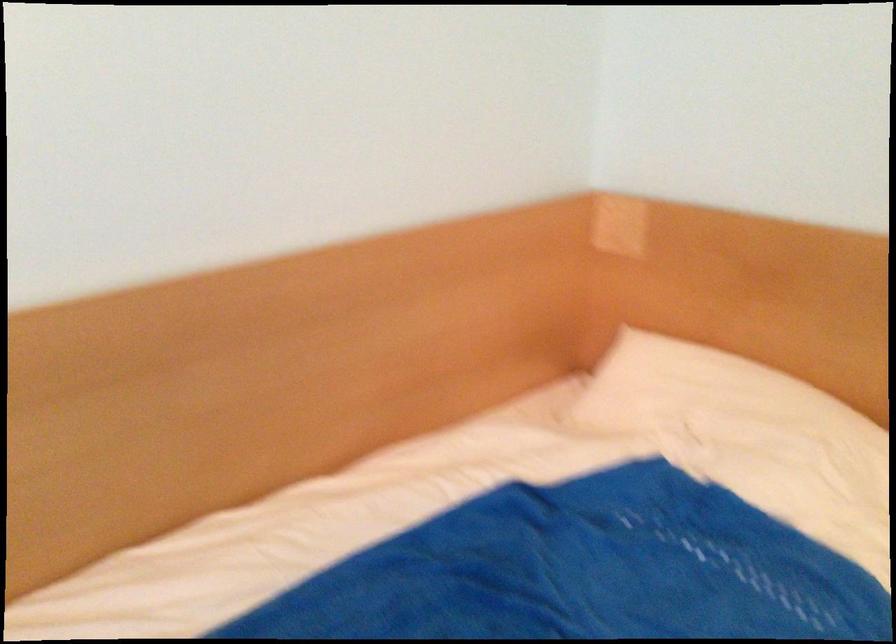
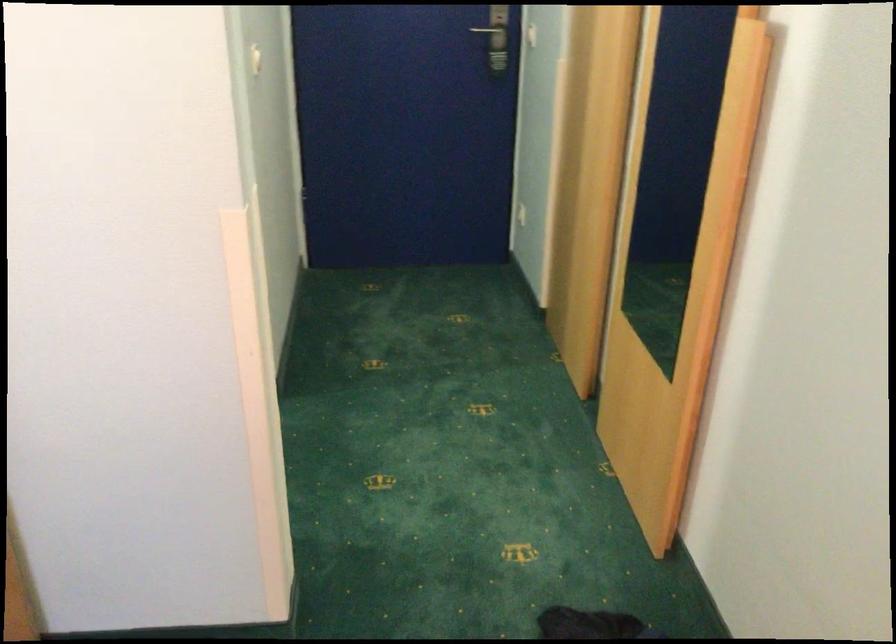
Question: How did the camera likely rotate?

Choices:
 (A) Left
 (B) Right
 (C) Up
 (D) Down

Answer: (B)